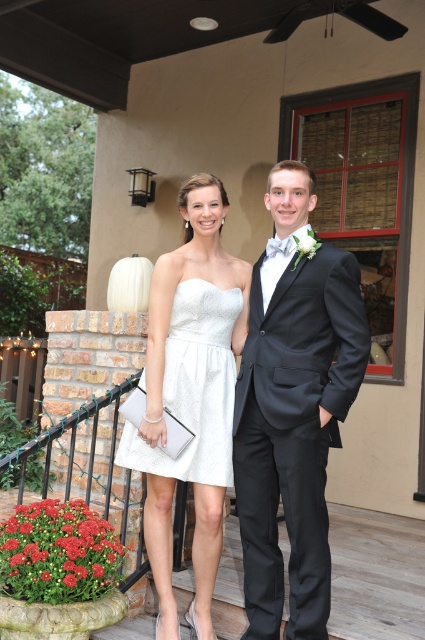
You are a photographer setting up for a prom photo shoot. You need to ensure that both the shiny black suit at center and the satin white dress at center are fully visible in the frame. Based on their positions, will you need to adjust the camera angle to avoid one covering the other?

The shiny black suit at center is positioned over the satin white dress at center, so adjusting the camera angle would be necessary to ensure both are fully visible without one covering the other.

You are a photographer trying to capture the perfect shot of the satin white dress at center. Based on the coordinates provided, where should you position your camera to ensure the dress is centered in the frame?

The satin white dress at center is located at coordinates point (190, 394), so positioning the camera directly facing that point will center the dress in the frame.